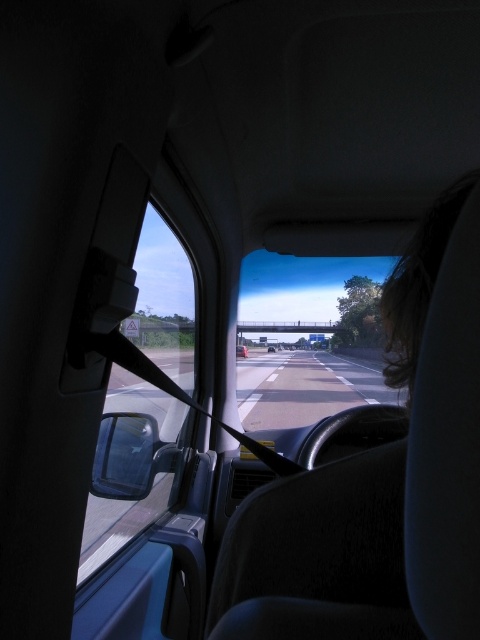
Is transparent glass windshield at center positioned behind metallic silver car at center?

No, transparent glass windshield at center is closer to the viewer.

Can you confirm if transparent glass windshield at center is wider than metallic silver car at center?

Yes, transparent glass windshield at center is wider than metallic silver car at center.

Is point (266, 372) positioned before point (240, 346)?

Yes, point (266, 372) is closer to viewer.

You are a GUI agent. You are given a task and a screenshot of the screen. Output one action in this format:
    pyautogui.click(x=<x>, y=<y>)
    Task: Click on the transparent glass windshield at center
    
    Given the screenshot: What is the action you would take?
    pyautogui.click(x=308, y=337)

Which is below, transparent glass windshield at center or transparent plastic side mirror at lower left?

transparent glass windshield at center is lower down.

Is point (254, 273) positioned before point (131, 417)?

No, it is not.

Is point (305, 317) more distant than point (118, 440)?

Yes, point (305, 317) is behind point (118, 440).

Where is `transparent glass windshield at center`? transparent glass windshield at center is located at coordinates (308, 337).

Based on the photo, does transparent plastic side mirror at lower left appear on the left side of metallic silver car at center?

Indeed, transparent plastic side mirror at lower left is positioned on the left side of metallic silver car at center.

Is transparent plastic side mirror at lower left bigger than metallic silver car at center?

Actually, transparent plastic side mirror at lower left might be smaller than metallic silver car at center.

Is point (107, 432) positioned after point (242, 355)?

That is False.

This screenshot has width=480, height=640. What are the coordinates of `transparent plastic side mirror at lower left` in the screenshot? It's located at (124, 456).